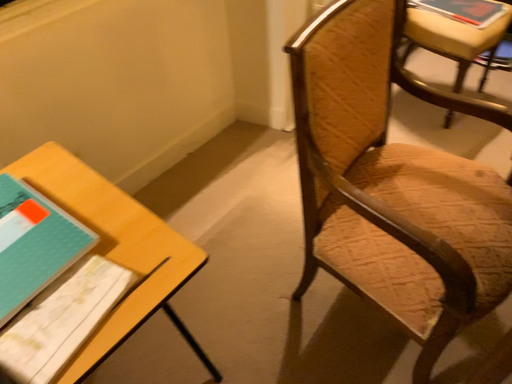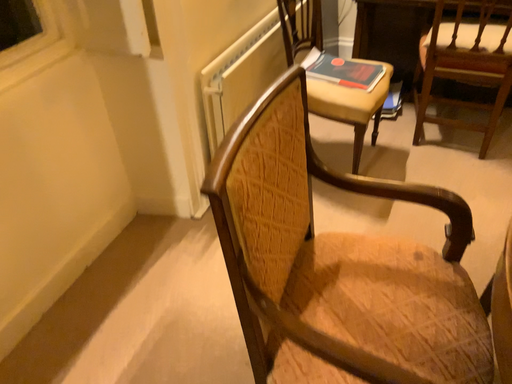
Question: Which way did the camera rotate in the video?

Choices:
 (A) rotated upward
 (B) rotated downward

Answer: (A)